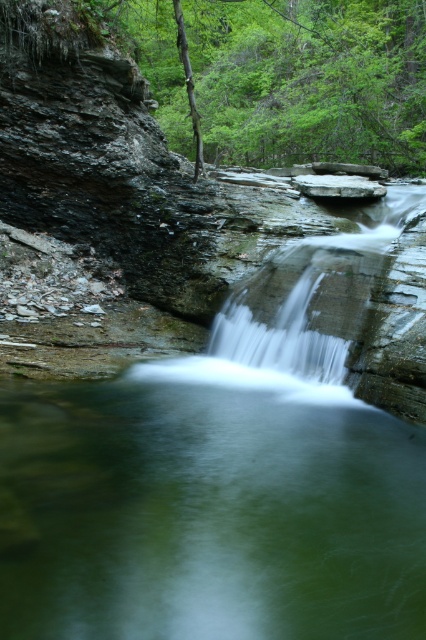
You are standing at the edge of the cliff and want to take a photo of both the green translucent water at center and the white smooth waterfall at center. Which object should you focus on first if you want to capture both in one frame?

You should focus on the white smooth waterfall at center first because the green translucent water at center is positioned to the left of it, so adjusting the camera to include both would require framing from the waterfall outward.

You are standing at the edge of the cliff and want to take a photo of the white smooth waterfall at center without the green translucent water at center appearing in the frame. Is this possible based on their positions?

The green translucent water at center is positioned under the white smooth waterfall at center, so it would be difficult to capture the waterfall without including the water below it in the frame.

You are standing at the edge of the cliff overlooking the waterfall and the pool below. You notice a specific point marked at coordinates point (207, 515). What is located at that point?

The point (207, 515) corresponds to green translucent water at center.